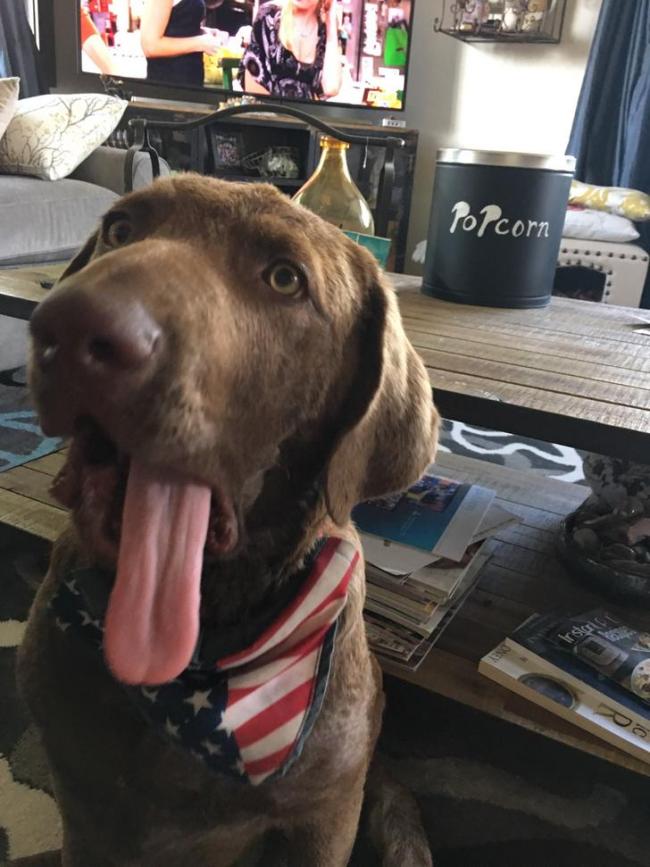
At what (x,y) coordinates should I click in order to perform the action: click on magazines on bottom shelf. Please return your answer as a coordinate pair (x, y). This screenshot has height=867, width=650. Looking at the image, I should click on (541, 681), (578, 650), (413, 559).